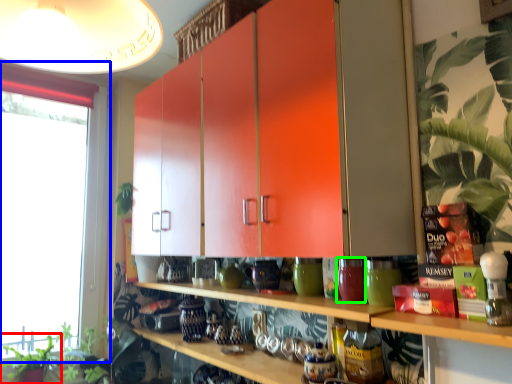
Question: Which object is the farthest from plant (highlighted by a red box)? Choose among these: window (highlighted by a blue box) or pottery (highlighted by a green box).

Choices:
 (A) window
 (B) pottery

Answer: (B)